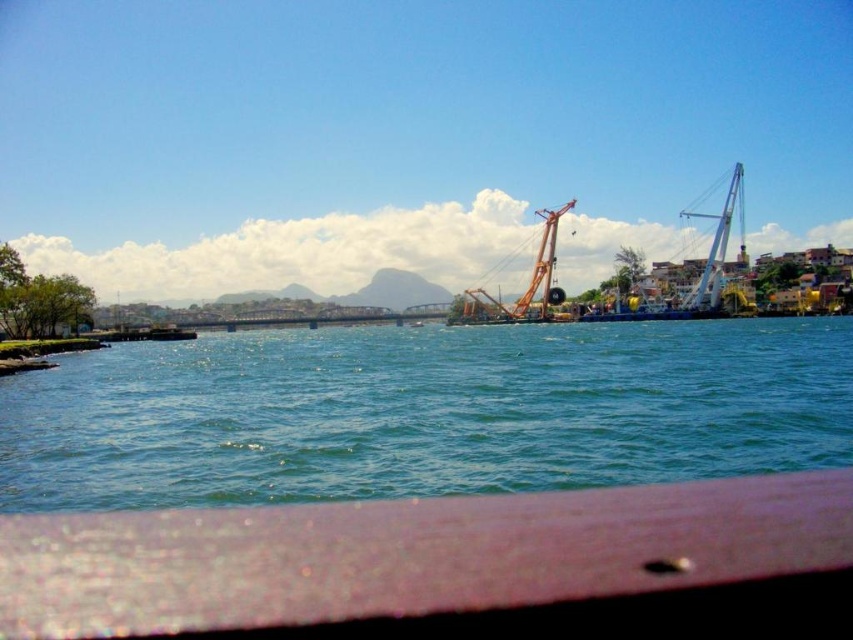
You are a construction worker on the white metallic crane at right. You need to lower a heavy tool into the green water at center. Is the crane positioned above the water to allow this?

The green water at center is below the white metallic crane at right, so yes, the crane is positioned above the water, allowing the tool to be lowered safely.

You are an engineer assessing the space between two cranes for a new equipment delivery. The equipment requires a minimum width of 10 meters to pass safely. Given the white metallic crane at right and the orange metallic crane at center, which crane has a wider base to ensure the equipment can fit through the space between them?

The white metallic crane at right has a wider base than the orange metallic crane at center, so the equipment should be guided through the space next to the white metallic crane at right to ensure sufficient width for safe passage.